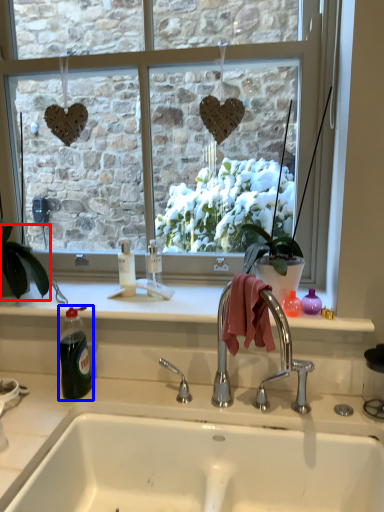
Question: Among these objects, which one is nearest to the camera, houseplant (highlighted by a red box) or bottle (highlighted by a blue box)?

Choices:
 (A) houseplant
 (B) bottle

Answer: (B)